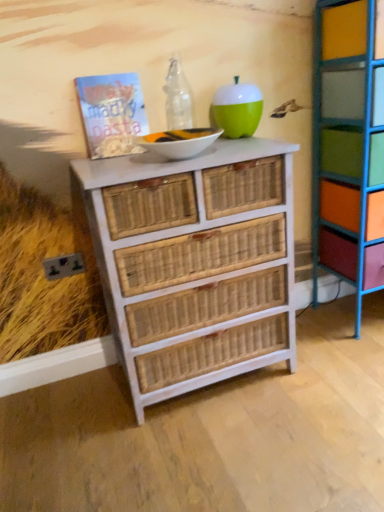
At what (x,y) coordinates should I click in order to perform the action: click on free space to the left of white wicker chest of drawers at center. Please return your answer as a coordinate pair (x, y). This screenshot has width=384, height=512. Looking at the image, I should click on (64, 422).